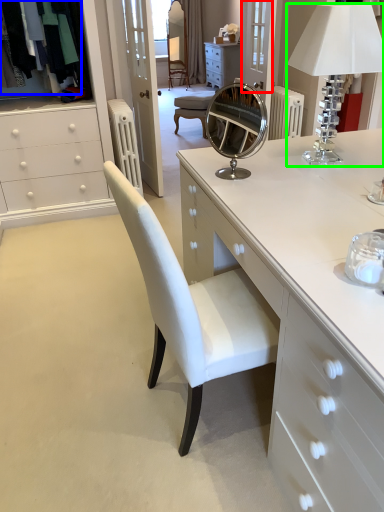
Question: Which is nearer to the glass door (highlighted by a red box)? clothing (highlighted by a blue box) or table lamp (highlighted by a green box).

Choices:
 (A) clothing
 (B) table lamp

Answer: (A)